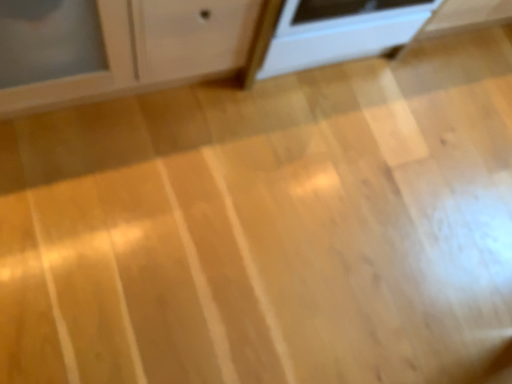
What do you see at coordinates (340, 31) in the screenshot?
I see `white glossy oven at upper center` at bounding box center [340, 31].

The image size is (512, 384). What are the coordinates of `white glossy oven at upper center` in the screenshot? It's located at (340, 31).

You are a GUI agent. You are given a task and a screenshot of the screen. Output one action in this format:
    pyautogui.click(x=<x>, y=<y>)
    Task: Click on the white glossy oven at upper center
    The height and width of the screenshot is (384, 512).
    Given the screenshot: What is the action you would take?
    pyautogui.click(x=340, y=31)